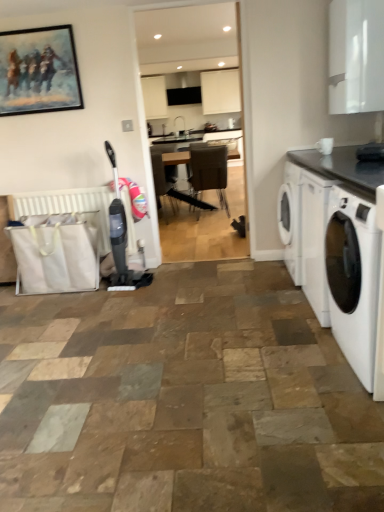
Question: From a real-world perspective, is white fabric radiator at lower left located beneath black granite countertop at right?

Choices:
 (A) yes
 (B) no

Answer: (A)

Question: Is white fabric radiator at lower left thinner than black granite countertop at right?

Choices:
 (A) no
 (B) yes

Answer: (B)

Question: Considering the relative sizes of white fabric radiator at lower left and black granite countertop at right in the image provided, is white fabric radiator at lower left shorter than black granite countertop at right?

Choices:
 (A) no
 (B) yes

Answer: (A)

Question: Does white fabric radiator at lower left appear on the right side of black granite countertop at right?

Choices:
 (A) yes
 (B) no

Answer: (B)

Question: Can you confirm if white fabric radiator at lower left is wider than black granite countertop at right?

Choices:
 (A) no
 (B) yes

Answer: (A)

Question: Is white glossy washing machine at right spatially inside oil painting at upper left, or outside of it?

Choices:
 (A) outside
 (B) inside

Answer: (A)

Question: Looking at the image, does white glossy washing machine at right seem bigger or smaller compared to oil painting at upper left?

Choices:
 (A) small
 (B) big

Answer: (B)

Question: Would you say white glossy washing machine at right is to the left or to the right of oil painting at upper left in the picture?

Choices:
 (A) right
 (B) left

Answer: (A)

Question: Considering the positions of white glossy washing machine at right and oil painting at upper left in the image, is white glossy washing machine at right wider or thinner than oil painting at upper left?

Choices:
 (A) thin
 (B) wide

Answer: (B)

Question: Considering the positions of oil painting at upper left and black granite countertop at right in the image, is oil painting at upper left taller or shorter than black granite countertop at right?

Choices:
 (A) short
 (B) tall

Answer: (B)

Question: From the image's perspective, relative to black granite countertop at right, is oil painting at upper left above or below?

Choices:
 (A) above
 (B) below

Answer: (A)

Question: Looking at the image, does oil painting at upper left seem bigger or smaller compared to black granite countertop at right?

Choices:
 (A) big
 (B) small

Answer: (B)

Question: Considering the positions of point (3, 87) and point (342, 163), is point (3, 87) closer or farther from the camera than point (342, 163)?

Choices:
 (A) closer
 (B) farther

Answer: (B)

Question: In the image, is white fabric radiator at lower left on the left side or the right side of brown leather chair at center?

Choices:
 (A) right
 (B) left

Answer: (B)

Question: In terms of height, does white fabric radiator at lower left look taller or shorter compared to brown leather chair at center?

Choices:
 (A) tall
 (B) short

Answer: (B)